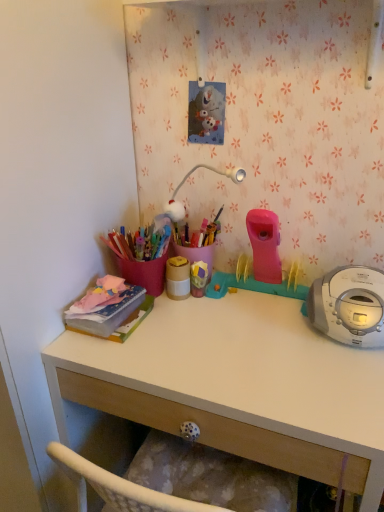
Describe the element at coordinates (178, 278) in the screenshot. I see `matte gold container at center, which is the 1th office supplies from right to left` at that location.

What do you see at coordinates (105, 306) in the screenshot? The image size is (384, 512). I see `matte pink notebook at left, marked as the 1th office supplies in a left-to-right arrangement` at bounding box center [105, 306].

Image resolution: width=384 pixels, height=512 pixels. In order to click on matte gold container at center, the 2th office supplies when ordered from left to right in this screenshot , I will do `click(178, 278)`.

Could you measure the distance between matte gold container at center, which is the 1th office supplies from right to left, and matte pink notebook at left, marked as the 1th office supplies in a left-to-right arrangement?

matte gold container at center, which is the 1th office supplies from right to left, is 6.76 inches away from matte pink notebook at left, marked as the 1th office supplies in a left-to-right arrangement.

Is matte pink notebook at left, which is counted as the 2th office supplies, starting from the right, at the back of matte gold container at center, the 2th office supplies when ordered from left to right?

No, matte gold container at center, the 2th office supplies when ordered from left to right, is not facing the opposite direction of matte pink notebook at left, which is counted as the 2th office supplies, starting from the right.

Is matte gold container at center, the 2th office supplies when ordered from left to right, wider or thinner than matte pink notebook at left, marked as the 1th office supplies in a left-to-right arrangement?

matte gold container at center, the 2th office supplies when ordered from left to right, is thinner than matte pink notebook at left, marked as the 1th office supplies in a left-to-right arrangement.

Is matte gold container at center, the 2th office supplies when ordered from left to right, closer to camera compared to matte pink notebook at left, which is counted as the 2th office supplies, starting from the right?

No, the depth of matte gold container at center, the 2th office supplies when ordered from left to right, is greater than that of matte pink notebook at left, which is counted as the 2th office supplies, starting from the right.

Does white matte desk at center lie in front of matte pink notebook at left, which is counted as the 2th office supplies, starting from the right?

That is True.

From the picture: From the image's perspective, is white matte desk at center on top of matte pink notebook at left, marked as the 1th office supplies in a left-to-right arrangement?

No, from the image's perspective, white matte desk at center is not over matte pink notebook at left, marked as the 1th office supplies in a left-to-right arrangement.

Considering the points (189, 415) and (117, 279), which point is behind, point (189, 415) or point (117, 279)?

The point (117, 279) is farther.

Who is bigger, matte pink notebook at left, which is counted as the 2th office supplies, starting from the right, or matte gold container at center, the 2th office supplies when ordered from left to right?

matte pink notebook at left, which is counted as the 2th office supplies, starting from the right.

Considering the relative sizes of matte pink notebook at left, which is counted as the 2th office supplies, starting from the right, and matte gold container at center, which is the 1th office supplies from right to left, in the image provided, is matte pink notebook at left, which is counted as the 2th office supplies, starting from the right, taller than matte gold container at center, which is the 1th office supplies from right to left,?

Incorrect, the height of matte pink notebook at left, which is counted as the 2th office supplies, starting from the right, is not larger of that of matte gold container at center, which is the 1th office supplies from right to left.

Could you tell me if matte pink notebook at left, marked as the 1th office supplies in a left-to-right arrangement, is turned towards matte gold container at center, which is the 1th office supplies from right to left?

No, matte pink notebook at left, marked as the 1th office supplies in a left-to-right arrangement, is not turned towards matte gold container at center, which is the 1th office supplies from right to left.

Which object is positioned more to the left, matte gold container at center, the 2th office supplies when ordered from left to right, or white matte desk at center?

From the viewer's perspective, matte gold container at center, the 2th office supplies when ordered from left to right, appears more on the left side.

This screenshot has height=512, width=384. Identify the location of desk that appears below the matte gold container at center, which is the 1th office supplies from right to left (from a real-world perspective). (237, 386).

Is matte gold container at center, the 2th office supplies when ordered from left to right, positioned with its back to white matte desk at center?

No, matte gold container at center, the 2th office supplies when ordered from left to right, is not facing away from white matte desk at center.

Is point (186, 281) closer to viewer compared to point (249, 345)?

No, it is behind (249, 345).

Looking at their sizes, would you say matte pink notebook at left, which is counted as the 2th office supplies, starting from the right, is wider or thinner than white matte desk at center?

Considering their sizes, matte pink notebook at left, which is counted as the 2th office supplies, starting from the right, looks slimmer than white matte desk at center.

Find the location of `desk lying in front of the matte pink notebook at left, marked as the 1th office supplies in a left-to-right arrangement`. desk lying in front of the matte pink notebook at left, marked as the 1th office supplies in a left-to-right arrangement is located at coordinates (237, 386).

How many degrees apart are the facing directions of matte pink notebook at left, which is counted as the 2th office supplies, starting from the right, and white matte desk at center?

The facing directions of matte pink notebook at left, which is counted as the 2th office supplies, starting from the right, and white matte desk at center are 5.36 degrees apart.

Is matte pink notebook at left, which is counted as the 2th office supplies, starting from the right, smaller than white matte desk at center?

Yes.

From the image's perspective, between white matte desk at center and matte gold container at center, the 2th office supplies when ordered from left to right, which one is located above?

From the image's view, matte gold container at center, the 2th office supplies when ordered from left to right, is above.

From a real-world perspective, which is physically above, white matte desk at center or matte gold container at center, which is the 1th office supplies from right to left?

In real-world perspective, matte gold container at center, which is the 1th office supplies from right to left, is above.

Is white matte desk at center wider or thinner than matte gold container at center, the 2th office supplies when ordered from left to right?

Clearly, white matte desk at center has more width compared to matte gold container at center, the 2th office supplies when ordered from left to right.

Is white matte desk at center touching matte gold container at center, which is the 1th office supplies from right to left?

There is a gap between white matte desk at center and matte gold container at center, which is the 1th office supplies from right to left.

At what (x,y) coordinates should I click in order to perform the action: click on office supplies located below the matte gold container at center, the 2th office supplies when ordered from left to right (from the image's perspective). Please return your answer as a coordinate pair (x, y). The image size is (384, 512). Looking at the image, I should click on (105, 306).

Locate an element on the screen. The width and height of the screenshot is (384, 512). desk in front of the matte pink notebook at left, which is counted as the 2th office supplies, starting from the right is located at coordinates (237, 386).

Which object lies nearer to the anchor point white matte desk at center, matte pink notebook at left, which is counted as the 2th office supplies, starting from the right, or matte gold container at center, which is the 1th office supplies from right to left?

matte pink notebook at left, which is counted as the 2th office supplies, starting from the right.

Looking at the image, which one is located closer to matte gold container at center, the 2th office supplies when ordered from left to right, matte pink notebook at left, which is counted as the 2th office supplies, starting from the right, or white matte desk at center?

matte pink notebook at left, which is counted as the 2th office supplies, starting from the right.

Estimate the real-world distances between objects in this image. Which object is closer to matte pink notebook at left, marked as the 1th office supplies in a left-to-right arrangement, matte gold container at center, the 2th office supplies when ordered from left to right, or white matte desk at center?

matte gold container at center, the 2th office supplies when ordered from left to right, is closer to matte pink notebook at left, marked as the 1th office supplies in a left-to-right arrangement.

Estimate the real-world distances between objects in this image. Which object is further from white matte desk at center, matte gold container at center, which is the 1th office supplies from right to left, or matte pink notebook at left, which is counted as the 2th office supplies, starting from the right?

matte gold container at center, which is the 1th office supplies from right to left, is further to white matte desk at center.

Based on their spatial positions, is white matte desk at center or matte pink notebook at left, which is counted as the 2th office supplies, starting from the right, further from matte gold container at center, the 2th office supplies when ordered from left to right?

white matte desk at center.

Which object lies nearer to the anchor point matte pink notebook at left, which is counted as the 2th office supplies, starting from the right, white matte desk at center or matte gold container at center, the 2th office supplies when ordered from left to right?

Based on the image, matte gold container at center, the 2th office supplies when ordered from left to right, appears to be nearer to matte pink notebook at left, which is counted as the 2th office supplies, starting from the right.

The image size is (384, 512). Find the location of `office supplies between matte gold container at center, which is the 1th office supplies from right to left, and white matte desk at center, in the vertical direction`. office supplies between matte gold container at center, which is the 1th office supplies from right to left, and white matte desk at center, in the vertical direction is located at coordinates (105, 306).